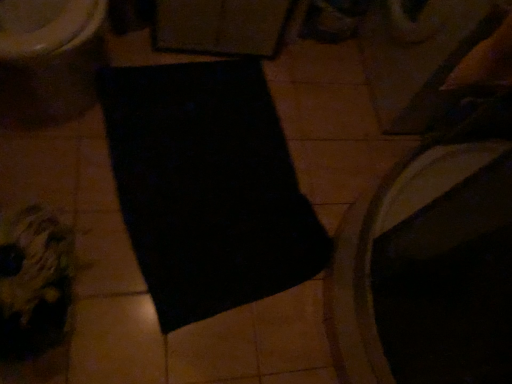
You are a GUI agent. You are given a task and a screenshot of the screen. Output one action in this format:
    pyautogui.click(x=<x>, y=<y>)
    Task: Click on the vacant space that's between matte white toilet at upper left and black matte yoga mat at center
    This screenshot has height=384, width=512.
    Given the screenshot: What is the action you would take?
    pyautogui.click(x=93, y=170)